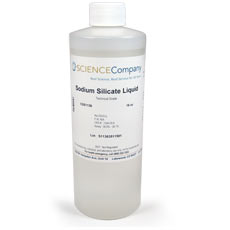
You are a GUI agent. You are given a task and a screenshot of the screen. Output one action in this format:
    pyautogui.click(x=<x>, y=<y>)
    Task: Click on the bottle
    The width and height of the screenshot is (230, 230).
    Given the screenshot: What is the action you would take?
    pyautogui.click(x=104, y=44)